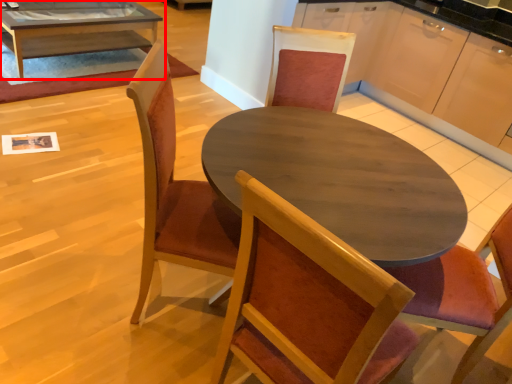
Question: From the image's perspective, what is the correct spatial positioning of coffee table (annotated by the red box) in reference to chair?

Choices:
 (A) below
 (B) above

Answer: (B)